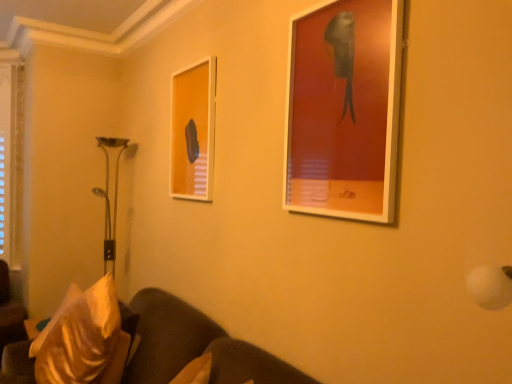
Question: In which direction should I rotate to look at matte glass picture frame at center, which is the 1th picture frame from back to front?

Choices:
 (A) right
 (B) left

Answer: (B)

Question: Can you confirm if matte white picture frame at upper right, the 2th picture frame in the back-to-front sequence, is shorter than velvet gold pillow at lower left?

Choices:
 (A) no
 (B) yes

Answer: (A)

Question: Is matte white picture frame at upper right, placed as the second picture frame when sorted from left to right, smaller than velvet gold pillow at lower left?

Choices:
 (A) yes
 (B) no

Answer: (A)

Question: Are matte white picture frame at upper right, marked as the first picture frame in a front-to-back arrangement, and velvet gold pillow at lower left far apart?

Choices:
 (A) no
 (B) yes

Answer: (B)

Question: Is matte white picture frame at upper right, arranged as the first picture frame when viewed from the right, outside of velvet gold pillow at lower left?

Choices:
 (A) yes
 (B) no

Answer: (A)

Question: Is matte white picture frame at upper right, placed as the second picture frame when sorted from left to right, oriented towards velvet gold pillow at lower left?

Choices:
 (A) no
 (B) yes

Answer: (A)

Question: From a real-world perspective, is matte white picture frame at upper right, arranged as the first picture frame when viewed from the right, physically above velvet gold pillow at lower left?

Choices:
 (A) no
 (B) yes

Answer: (B)

Question: From the image's perspective, would you say matte glass picture frame at center, which is counted as the second picture frame, starting from the front, is shown under matte white picture frame at upper right, placed as the second picture frame when sorted from left to right?

Choices:
 (A) yes
 (B) no

Answer: (B)

Question: Is the depth of matte glass picture frame at center, the second picture frame in the right-to-left sequence, greater than that of matte white picture frame at upper right, the 2th picture frame in the back-to-front sequence?

Choices:
 (A) no
 (B) yes

Answer: (B)

Question: From a real-world perspective, is matte glass picture frame at center, which is counted as the second picture frame, starting from the front, on top of matte white picture frame at upper right, arranged as the first picture frame when viewed from the right?

Choices:
 (A) yes
 (B) no

Answer: (B)

Question: Can you confirm if matte glass picture frame at center, the second picture frame in the right-to-left sequence, is wider than matte white picture frame at upper right, marked as the first picture frame in a front-to-back arrangement?

Choices:
 (A) no
 (B) yes

Answer: (A)

Question: Could you tell me if matte glass picture frame at center, the second picture frame in the right-to-left sequence, is facing matte white picture frame at upper right, arranged as the first picture frame when viewed from the right?

Choices:
 (A) no
 (B) yes

Answer: (A)

Question: Can matte white picture frame at upper right, arranged as the first picture frame when viewed from the right, be found inside matte glass picture frame at center, the second picture frame in the right-to-left sequence?

Choices:
 (A) no
 (B) yes

Answer: (A)

Question: Considering the relative sizes of matte glass picture frame at center, the second picture frame in the right-to-left sequence, and velvet gold pillow at lower left in the image provided, is matte glass picture frame at center, the second picture frame in the right-to-left sequence, smaller than velvet gold pillow at lower left?

Choices:
 (A) no
 (B) yes

Answer: (B)